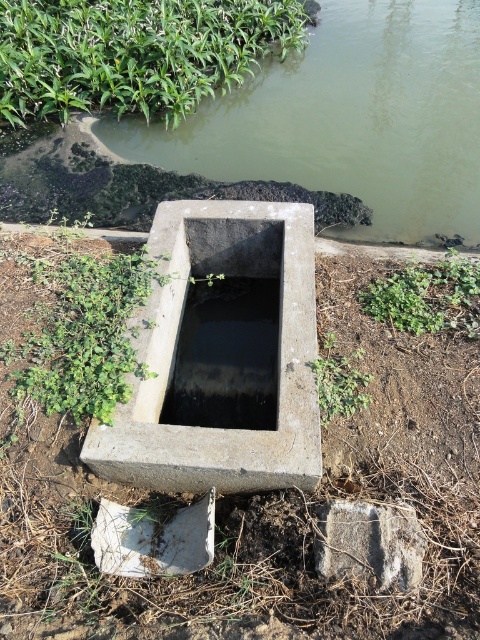
Question: Among these points, which one is farthest from the camera?

Choices:
 (A) (328, 502)
 (B) (222, 397)

Answer: (B)

Question: Is concrete rectangular at center bigger than green leafy plant at lower center?

Choices:
 (A) no
 (B) yes

Answer: (B)

Question: Is the position of concreteroughwater channel at center less distant than that of black concrete puddle at center?

Choices:
 (A) yes
 (B) no

Answer: (A)

Question: Which object appears closest to the camera in this image?

Choices:
 (A) gray rough concrete at lower center
 (B) green leafy plant at lower center
 (C) concrete rectangular at center

Answer: (A)

Question: Which point appears farthest from the camera in this image?

Choices:
 (A) (204, 410)
 (B) (219, 218)

Answer: (B)

Question: From the image, what is the correct spatial relationship of green leafy plant at upper left in relation to green leafy plant at lower center?

Choices:
 (A) left
 (B) right

Answer: (A)